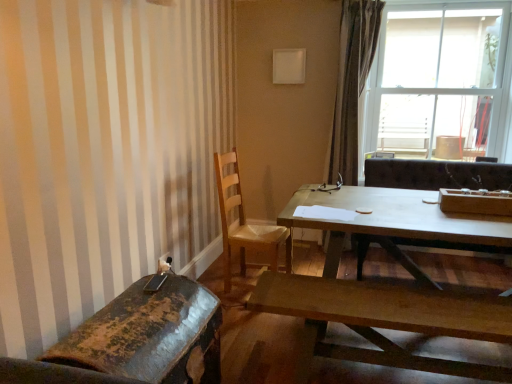
Question: Is wooden bench at lower center, the 2th coffee table viewed from the back, outside of transparent glass window at upper right?

Choices:
 (A) yes
 (B) no

Answer: (A)

Question: Is wooden bench at lower center, which appears as the first coffee table when viewed from the front, in front of transparent glass window at upper right?

Choices:
 (A) no
 (B) yes

Answer: (B)

Question: Considering the relative sizes of wooden bench at lower center, the 2th coffee table viewed from the back, and transparent glass window at upper right in the image provided, is wooden bench at lower center, the 2th coffee table viewed from the back, taller than transparent glass window at upper right?

Choices:
 (A) no
 (B) yes

Answer: (A)

Question: Considering the relative sizes of wooden bench at lower center, which appears as the first coffee table when viewed from the front, and transparent glass window at upper right in the image provided, is wooden bench at lower center, which appears as the first coffee table when viewed from the front, shorter than transparent glass window at upper right?

Choices:
 (A) no
 (B) yes

Answer: (B)

Question: From a real-world perspective, is wooden bench at lower center, which appears as the first coffee table when viewed from the front, on top of transparent glass window at upper right?

Choices:
 (A) no
 (B) yes

Answer: (A)

Question: Visually, is rusty metal chair at lower left, which is counted as the 1th chair, starting from the front, positioned to the left or to the right of wooden bench at lower center, which appears as the first coffee table when viewed from the front?

Choices:
 (A) right
 (B) left

Answer: (B)

Question: From a real-world perspective, is rusty metal chair at lower left, the 2th chair positioned from the back, positioned above or below wooden bench at lower center, the 2th coffee table viewed from the back?

Choices:
 (A) below
 (B) above

Answer: (B)

Question: From the image's perspective, is rusty metal chair at lower left, which is counted as the 1th chair, starting from the front, located above or below wooden bench at lower center, the 2th coffee table viewed from the back?

Choices:
 (A) above
 (B) below

Answer: (B)

Question: Looking at the image, does rusty metal chair at lower left, the 2th chair positioned from the back, seem bigger or smaller compared to wooden bench at lower center, which appears as the first coffee table when viewed from the front?

Choices:
 (A) big
 (B) small

Answer: (B)

Question: Would you say wooden chair at center, arranged as the 1th chair when viewed from the back, is inside or outside light brown wooden table at center, placed as the 2th coffee table when sorted from front to back?

Choices:
 (A) inside
 (B) outside

Answer: (B)

Question: Based on their positions, is wooden chair at center, the 2th chair viewed from the front, located to the left or right of light brown wooden table at center, placed as the 2th coffee table when sorted from front to back?

Choices:
 (A) right
 (B) left

Answer: (B)

Question: From a real-world perspective, is wooden chair at center, arranged as the 1th chair when viewed from the back, above or below light brown wooden table at center, which is the first coffee table from back to front?

Choices:
 (A) above
 (B) below

Answer: (A)

Question: In terms of height, does wooden chair at center, the 2th chair viewed from the front, look taller or shorter compared to light brown wooden table at center, which is the first coffee table from back to front?

Choices:
 (A) short
 (B) tall

Answer: (B)

Question: Is light brown wooden table at center, placed as the 2th coffee table when sorted from front to back, to the left or to the right of wooden chair at center, the 2th chair viewed from the front, in the image?

Choices:
 (A) right
 (B) left

Answer: (A)

Question: In the image, is light brown wooden table at center, placed as the 2th coffee table when sorted from front to back, positioned in front of or behind wooden chair at center, arranged as the 1th chair when viewed from the back?

Choices:
 (A) front
 (B) behind

Answer: (A)